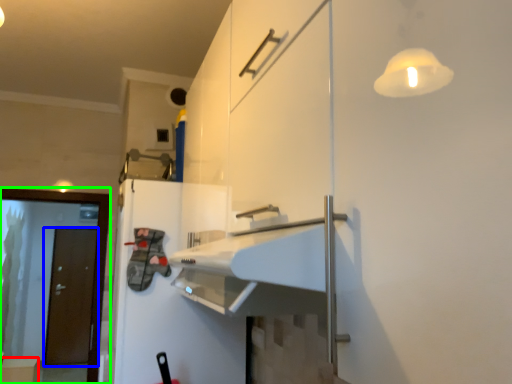
Question: Which object is the farthest from cabinetry (highlighted by a red box)? Choose among these: door (highlighted by a blue box) or screen door (highlighted by a green box).

Choices:
 (A) door
 (B) screen door

Answer: (B)